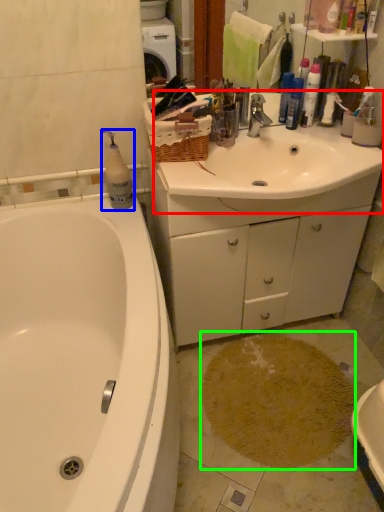
Question: Based on their relative distances, which object is nearer to sink (highlighted by a red box)? Choose from cleaning product (highlighted by a blue box) and stain (highlighted by a green box).

Choices:
 (A) cleaning product
 (B) stain

Answer: (A)